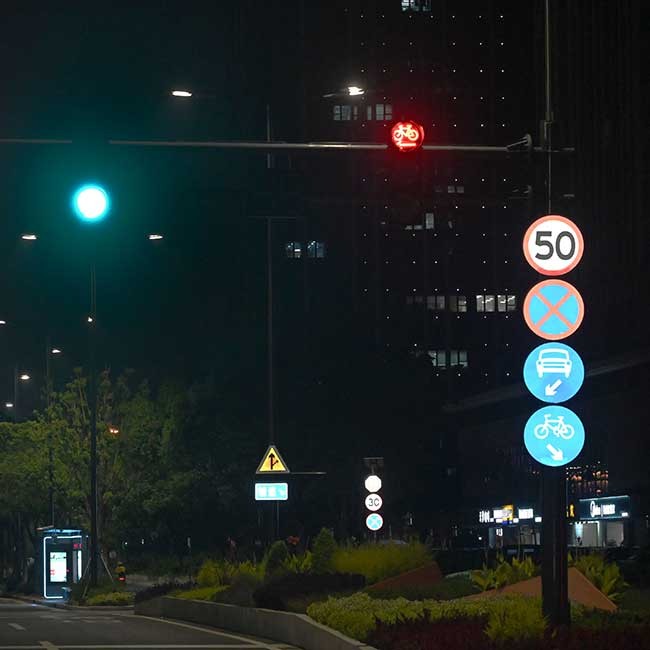
You are a GUI agent. You are given a task and a screenshot of the screen. Output one action in this format:
    pyautogui.click(x=<x>, y=<y>)
    Task: Click on the light
    The image size is (650, 650).
    Given the screenshot: What is the action you would take?
    pyautogui.click(x=92, y=325)